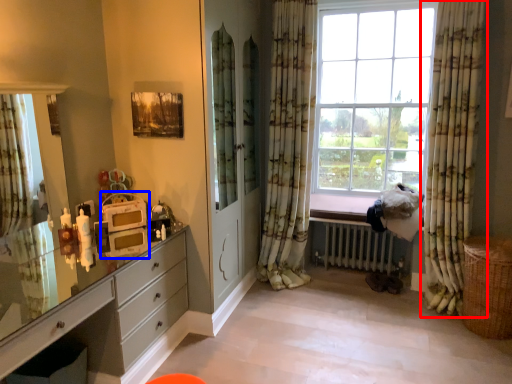
Question: Among these objects, which one is nearest to the camera, curtain (highlighted by a red box) or appliance (highlighted by a blue box)?

Choices:
 (A) curtain
 (B) appliance

Answer: (B)